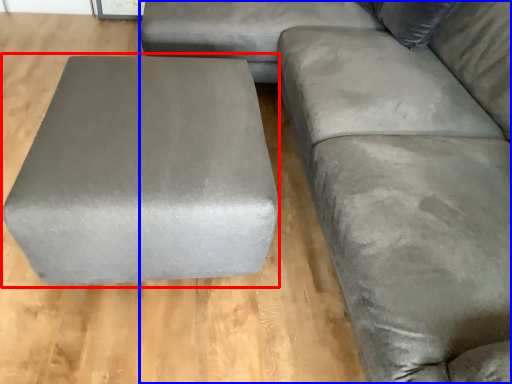
Question: Which point is closer to the camera, stool (highlighted by a red box) or studio couch (highlighted by a blue box)?

Choices:
 (A) stool
 (B) studio couch

Answer: (B)